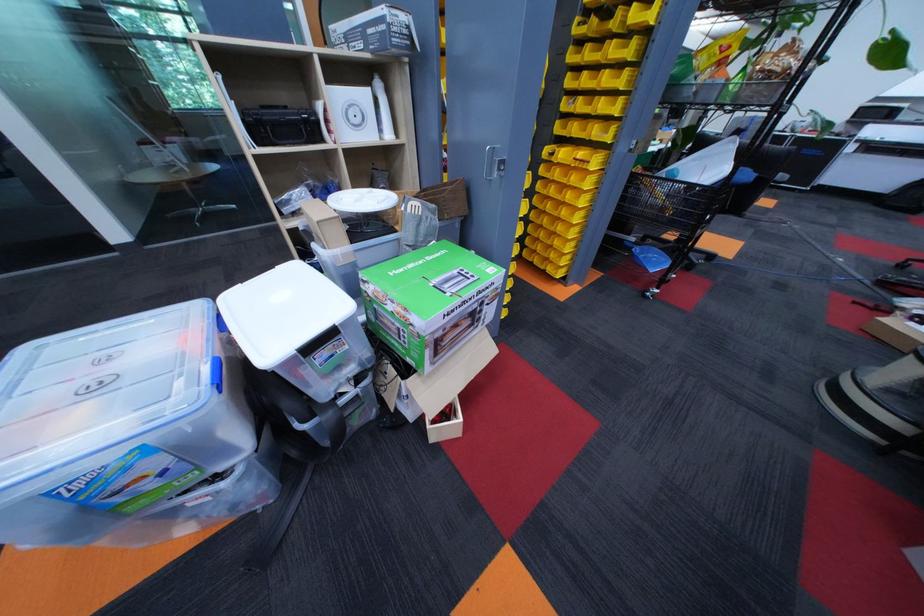
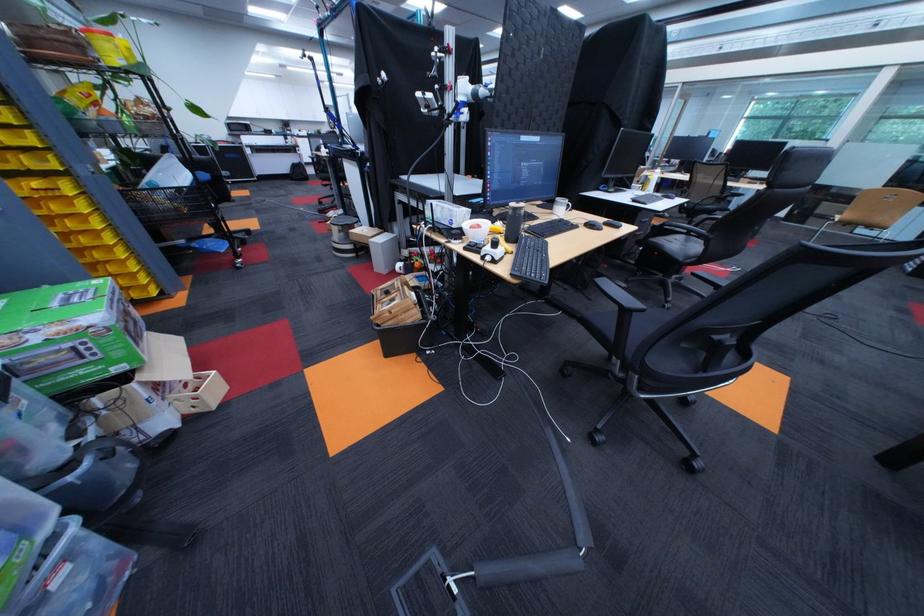
Where in the second image is the point corresponding to pixel 469 326 from the first image?

(139, 322)